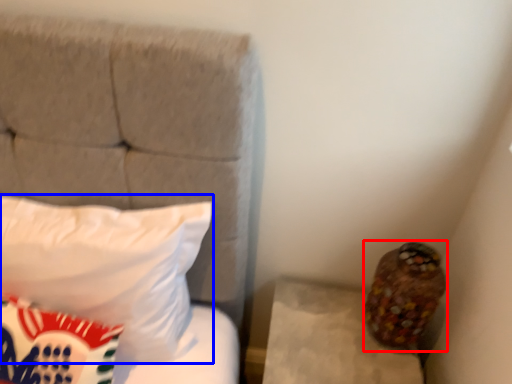
Question: Which object appears farthest to the camera in this image, stuff (highlighted by a red box) or pillow (highlighted by a blue box)?

Choices:
 (A) stuff
 (B) pillow

Answer: (A)